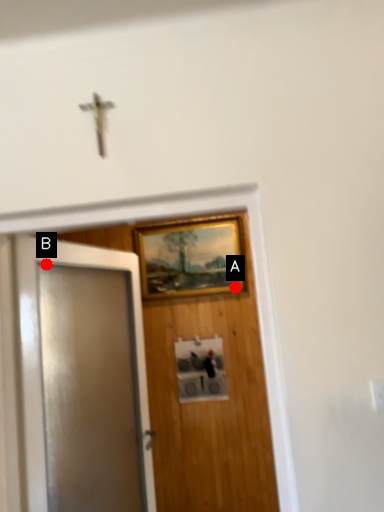
Question: Two points are circled on the image, labeled by A and B beside each circle. Which point is farther from the camera taking this photo?

Choices:
 (A) A is further
 (B) B is further

Answer: (A)